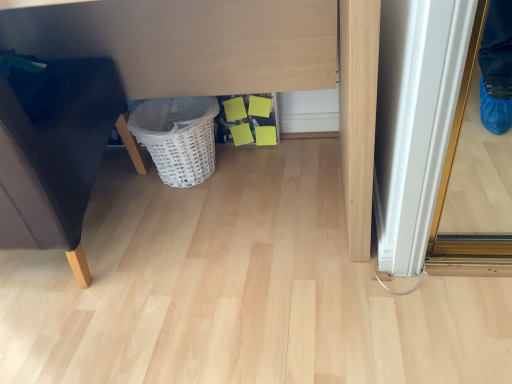
The height and width of the screenshot is (384, 512). Identify the location of vacant area located to the right-hand side of white wicker basket at lower center. (260, 167).